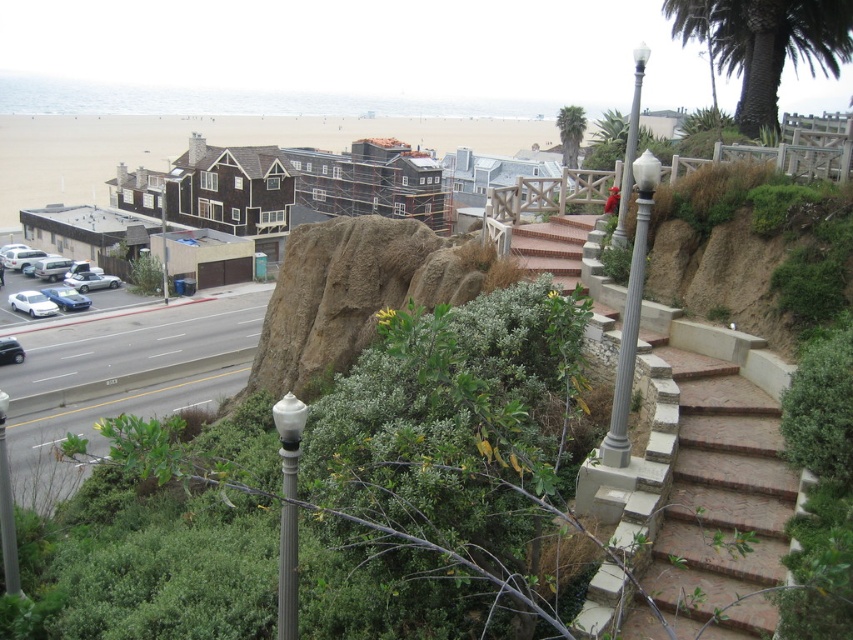
Question: Can you confirm if white matte car at lower left is thinner than satin silver sedan at lower left?

Choices:
 (A) yes
 (B) no

Answer: (B)

Question: Which object is positioned closest to the shiny black car at lower left?

Choices:
 (A) brushed metal pole at center
 (B) white matte car at lower left

Answer: (B)

Question: Is brick stairs at right smaller than shiny black car at lower left?

Choices:
 (A) yes
 (B) no

Answer: (A)

Question: Considering the real-world distances, which object is closest to the green leafy palm tree at upper center?

Choices:
 (A) satin silver sedan at lower left
 (B) shiny black car at lower left

Answer: (A)

Question: Which of these objects is positioned farthest from the white matte car at lower left?

Choices:
 (A) white glossy lamp post at upper right
 (B) green leafy palm tree at upper center

Answer: (B)

Question: Is white glossy lamp post at center behind white matte car at lower left?

Choices:
 (A) yes
 (B) no

Answer: (B)